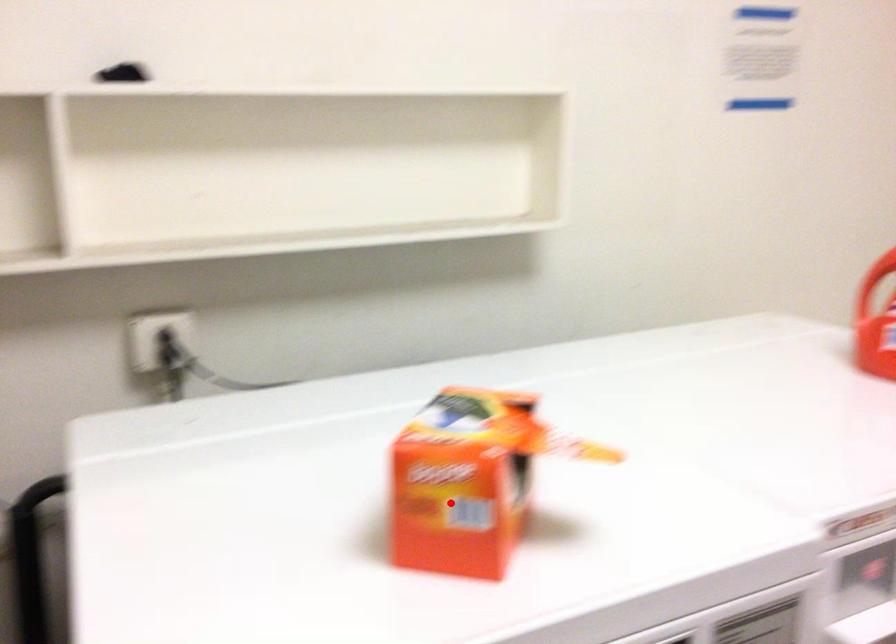
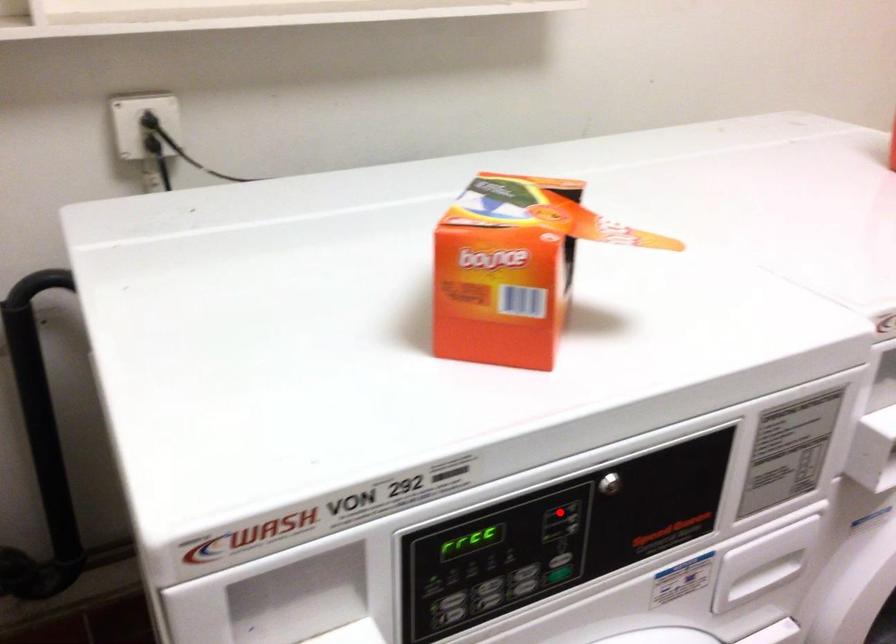
I am providing you with two images of the same scene from different viewpoints. A red point is marked on the first image and another point is marked on the second image. Do the highlighted points in image1 and image2 indicate the same real-world spot?

No